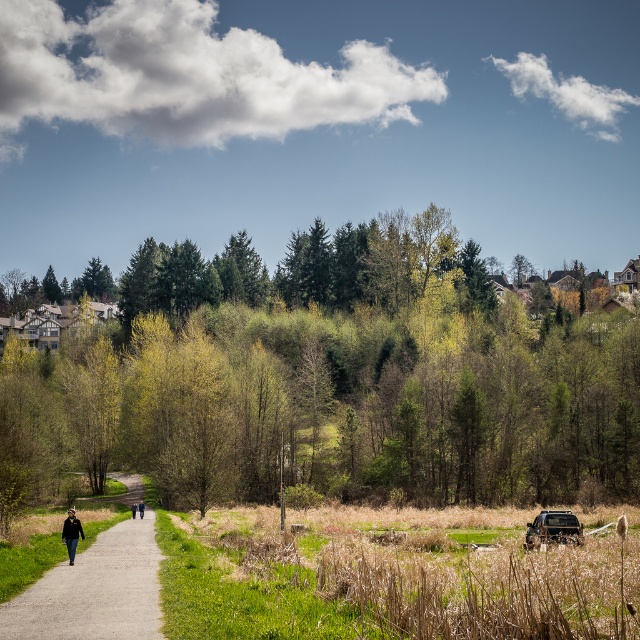
You are standing on the path and want to reach the metallic silver jeep at lower right. Which direction should you walk to get closer to it, away from the green leafy tree at center?

Since the green leafy tree at center is closer to you than the metallic silver jeep at lower right, you should walk away from the tree to move towards the jeep.

You are standing on the paved path in the scene and want to know if the green leafy tree at center is taller than the dark blue jacket at lower left. Can you determine this based on the scene?

The green leafy tree at center is taller than the dark blue jacket at lower left, so yes, the tree is taller than the jacket.